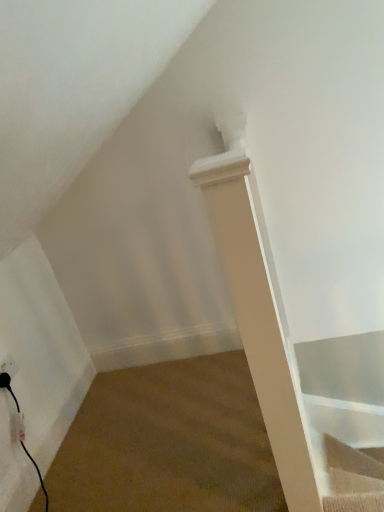
What do you see at coordinates (7, 371) in the screenshot?
I see `black plastic electric outlet at lower left` at bounding box center [7, 371].

The image size is (384, 512). Identify the location of black plastic electric outlet at lower left. (7, 371).

Locate an element on the screen. black plastic electric outlet at lower left is located at coordinates (7, 371).